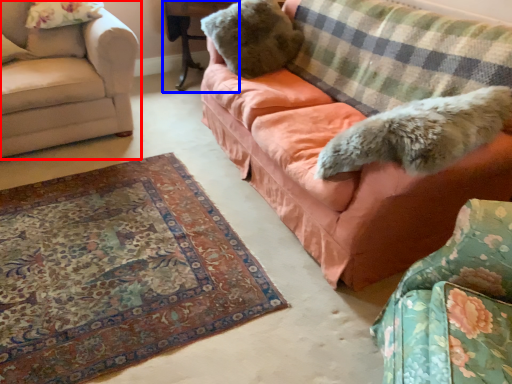
Question: Which point is further to the camera, studio couch (highlighted by a red box) or table (highlighted by a blue box)?

Choices:
 (A) studio couch
 (B) table

Answer: (B)